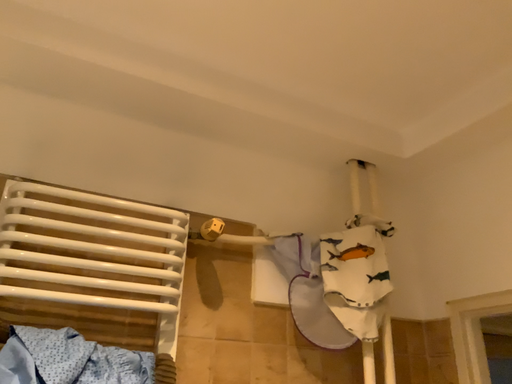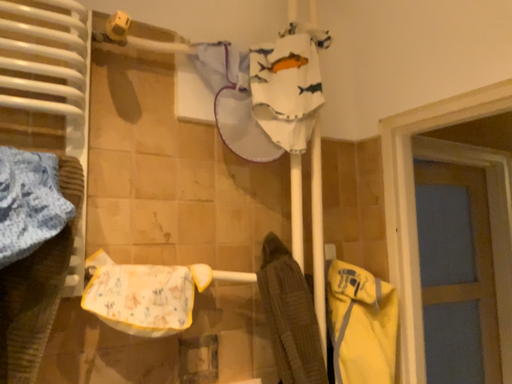
Question: Which way did the camera rotate in the video?

Choices:
 (A) rotated upward
 (B) rotated downward

Answer: (B)